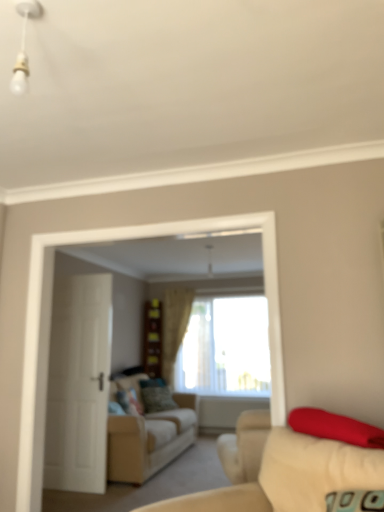
Question: Do you think white matte door at left is within beige fabric curtain at center, or outside of it?

Choices:
 (A) inside
 (B) outside

Answer: (B)

Question: Relative to beige fabric curtain at center, is white matte door at left in front or behind?

Choices:
 (A) behind
 (B) front

Answer: (B)

Question: Estimate the real-world distances between objects in this image. Which object is farther from the beige fabric curtain at center?

Choices:
 (A) matte red pillow at right, which is the 1th pillow in front-to-back order
 (B) beige fabric couch at lower right, the second studio couch when ordered from bottom to top
 (C) velvet green pillow at center, the third pillow in the right-to-left sequence
 (D) white glossy bulb at upper left
 (E) white matte door at left

Answer: (D)

Question: Which of these objects is positioned farthest from the beige fabric couch at lower right, the second studio couch when ordered from bottom to top?

Choices:
 (A) velvet green pillow at center, which is the second pillow from front to back
 (B) beige fabric curtain at center
 (C) velvet red pillow at center, which is the 2th pillow from right to left
 (D) wooden dresser at center
 (E) beige fabric couch at center, which is counted as the 1th studio couch, starting from the back

Answer: (D)